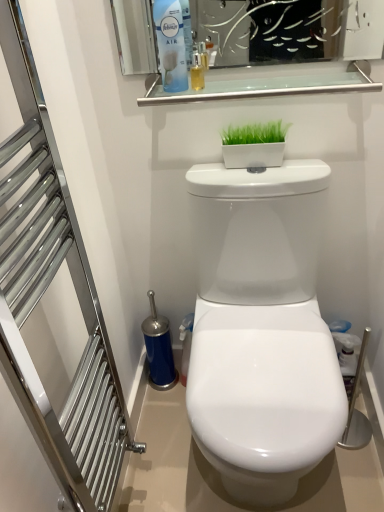
The width and height of the screenshot is (384, 512). What are the coordinates of `vacant area that lies in front of white glossy rectangular planter at upper center` in the screenshot? It's located at (268, 176).